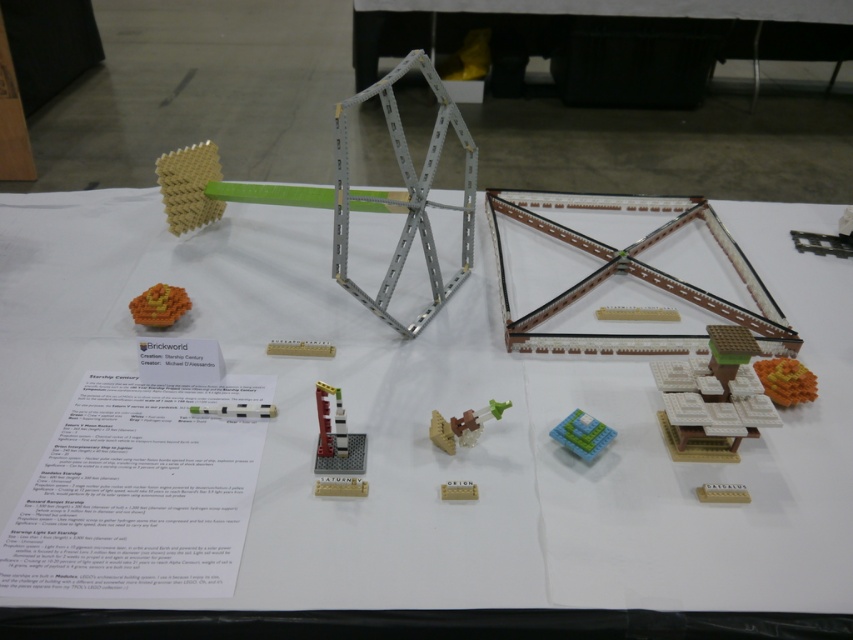
Is point (285, 570) in front of point (498, 403)?

Yes, it is in front of point (498, 403).

Can you confirm if white plastic table at center is positioned to the right of translucent plastic figure at center?

In fact, white plastic table at center is to the left of translucent plastic figure at center.

Does point (296, 326) lie behind point (450, 422)?

Yes, point (296, 326) is farther from viewer.

Where is `white plastic table at center`? This screenshot has width=853, height=640. white plastic table at center is located at coordinates (426, 433).

Which of these two, orange matte cube at lower right or translucent plastic figure at center, stands taller?

Standing taller between the two is translucent plastic figure at center.

Is orange matte cube at lower right taller than translucent plastic figure at center?

No, orange matte cube at lower right is not taller than translucent plastic figure at center.

Which is in front, point (770, 380) or point (508, 404)?

Point (508, 404)

You are a GUI agent. You are given a task and a screenshot of the screen. Output one action in this format:
    pyautogui.click(x=<x>, y=<y>)
    Task: Click on the orange matte cube at lower right
    This screenshot has width=853, height=640.
    Given the screenshot: What is the action you would take?
    pyautogui.click(x=785, y=380)

Does white matte building at center right appear on the left side of matte brown brick at center?

Incorrect, white matte building at center right is not on the left side of matte brown brick at center.

Between white matte building at center right and matte brown brick at center, which one appears on the right side from the viewer's perspective?

white matte building at center right is more to the right.

Who is more distant from viewer, (747, 428) or (465, 493)?

The point (747, 428) is behind.

The image size is (853, 640). What are the coordinates of `white matte building at center right` in the screenshot? It's located at (712, 397).